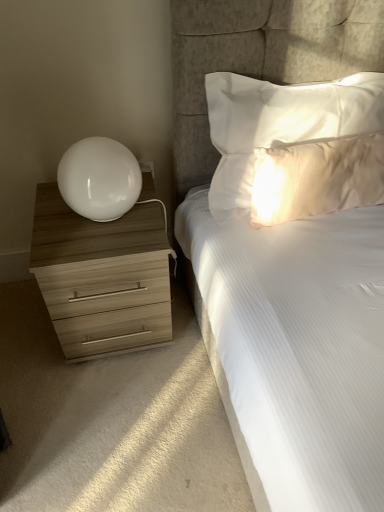
Find the location of `free spot above white glossy table lamp at left (from a real-world perspective)`. free spot above white glossy table lamp at left (from a real-world perspective) is located at coordinates pos(94,148).